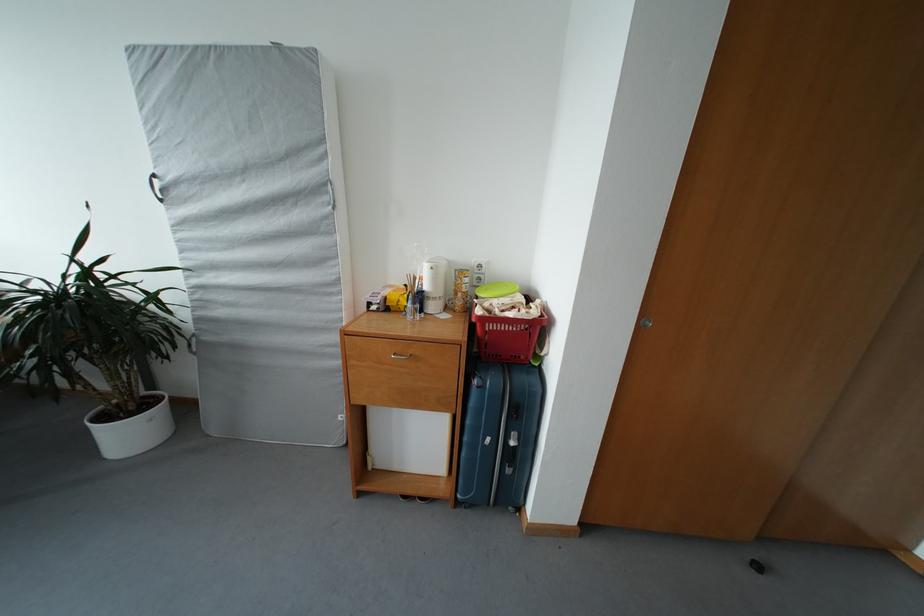
Where would you push the kettle power button? Please return your answer as a coordinate pair (x, y).

(429, 301)